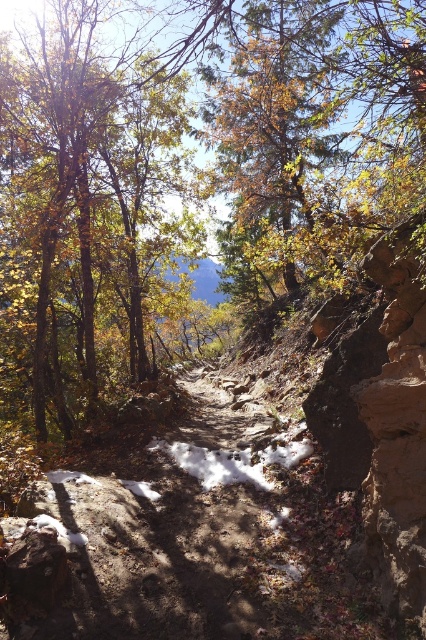
Question: Is brown leafy tree at center thinner than white fluffy snow at center?

Choices:
 (A) no
 (B) yes

Answer: (A)

Question: Is brown leafy tree at center to the right of white fluffy snow at center from the viewer's perspective?

Choices:
 (A) yes
 (B) no

Answer: (B)

Question: Among these objects, which one is nearest to the camera?

Choices:
 (A) white fluffy snow at center
 (B) brown leafy tree at center

Answer: (B)

Question: Among these points, which one is farthest from the camera?

Choices:
 (A) (40, 348)
 (B) (293, 442)

Answer: (A)

Question: In this image, where is brown leafy tree at center located relative to white fluffy snow at center?

Choices:
 (A) left
 (B) right

Answer: (A)